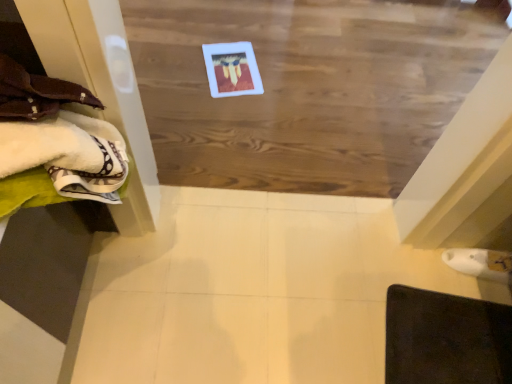
Image resolution: width=512 pixels, height=384 pixels. What do you see at coordinates (55, 133) in the screenshot?
I see `white soft towels at left` at bounding box center [55, 133].

Locate an element on the screen. The image size is (512, 384). white soft towels at left is located at coordinates (55, 133).

Is the depth of wooden board at center greater than that of dark brown leather mat at lower right?

Yes, wooden board at center is further from the viewer.

Who is taller, wooden board at center or dark brown leather mat at lower right?

Standing taller between the two is wooden board at center.

How different are the orientations of wooden board at center and dark brown leather mat at lower right in degrees?

81.5 degrees.

Does dark brown leather mat at lower right appear on the right side of white soft towels at left?

Yes.

Can you confirm if dark brown leather mat at lower right is smaller than white soft towels at left?

Yes.

Considering the sizes of dark brown leather mat at lower right and white soft towels at left in the image, is dark brown leather mat at lower right wider or thinner than white soft towels at left?

dark brown leather mat at lower right is wider than white soft towels at left.

Between dark brown leather mat at lower right and white soft towels at left, which one is positioned in front?

white soft towels at left is more forward.

Does white soft towels at left have a greater width compared to dark brown leather mat at lower right?

No.

Which of these two, white soft towels at left or dark brown leather mat at lower right, is smaller?

Smaller between the two is dark brown leather mat at lower right.

Is white soft towels at left to the left or to the right of dark brown leather mat at lower right in the image?

In the image, white soft towels at left appears on the left side of dark brown leather mat at lower right.

Choose the correct answer: Is white soft towels at left inside dark brown leather mat at lower right or outside it?

The correct answer is: outside.

Where is `plywood located underneath the white soft towels at left (from a real-world perspective)`? plywood located underneath the white soft towels at left (from a real-world perspective) is located at coordinates (307, 89).

Considering the relative positions of white soft towels at left and wooden board at center in the image provided, is white soft towels at left to the left or to the right of wooden board at center?

Clearly, white soft towels at left is on the left of wooden board at center in the image.

Considering the sizes of objects white soft towels at left and wooden board at center in the image provided, who is wider, white soft towels at left or wooden board at center?

Wider between the two is wooden board at center.

In the scene shown: Is white soft towels at left next to wooden board at center and touching it?

white soft towels at left and wooden board at center are clearly separated.

How distant is wooden board at center from white soft towels at left?

wooden board at center is 37.41 inches from white soft towels at left.

Is wooden board at center not inside white soft towels at left?

wooden board at center is positioned outside white soft towels at left.

This screenshot has width=512, height=384. I want to click on clothing in front of the wooden board at center, so click(55, 133).

Looking at this image, is the surface of wooden board at center in direct contact with white soft towels at left?

wooden board at center and white soft towels at left are not in contact.

Looking at the image, does dark brown leather mat at lower right seem bigger or smaller compared to wooden board at center?

dark brown leather mat at lower right is smaller than wooden board at center.

Is dark brown leather mat at lower right touching wooden board at center?

No, dark brown leather mat at lower right is not making contact with wooden board at center.

Is point (405, 338) closer to viewer compared to point (386, 19)?

Yes, it is.

Could wooden board at center be considered to be inside dark brown leather mat at lower right?

That's incorrect, wooden board at center is not inside dark brown leather mat at lower right.

Image resolution: width=512 pixels, height=384 pixels. Find the location of `furniture that appears below the wooden board at center (from the image's perspective)`. furniture that appears below the wooden board at center (from the image's perspective) is located at coordinates (446, 339).

What are the coordinates of `clothing on the left of dark brown leather mat at lower right` in the screenshot? It's located at (55, 133).

Which object lies further to the anchor point wooden board at center, dark brown leather mat at lower right or white soft towels at left?

white soft towels at left is further to wooden board at center.

Which object lies nearer to the anchor point wooden board at center, white soft towels at left or dark brown leather mat at lower right?

dark brown leather mat at lower right lies closer to wooden board at center than the other object.

When comparing their distances from white soft towels at left, does wooden board at center or dark brown leather mat at lower right seem further?

Among the two, dark brown leather mat at lower right is located further to white soft towels at left.

Based on their spatial positions, is white soft towels at left or wooden board at center closer to dark brown leather mat at lower right?

Among the two, wooden board at center is located nearer to dark brown leather mat at lower right.

Looking at the image, which one is located further to dark brown leather mat at lower right, wooden board at center or white soft towels at left?

white soft towels at left.

Which object lies nearer to the anchor point white soft towels at left, dark brown leather mat at lower right or wooden board at center?

wooden board at center lies closer to white soft towels at left than the other object.

Locate an element on the screen. Image resolution: width=512 pixels, height=384 pixels. plywood between white soft towels at left and dark brown leather mat at lower right from left to right is located at coordinates (307, 89).